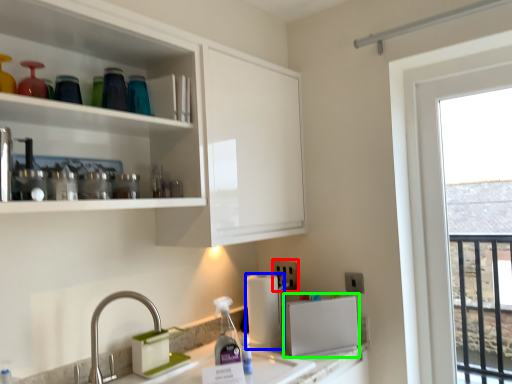
Question: Which is farther away from electric outlet (highlighted by a red box)? paper towel (highlighted by a blue box) or appliance (highlighted by a green box)?

Choices:
 (A) paper towel
 (B) appliance

Answer: (B)